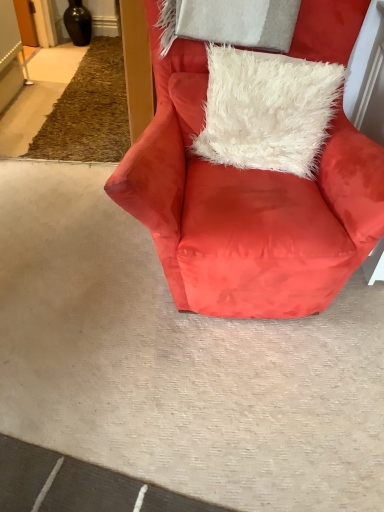
You are a GUI agent. You are given a task and a screenshot of the screen. Output one action in this format:
    pyautogui.click(x=<x>, y=<y>)
    Task: Click on the free space in front of satin red armchair at center
    The width and height of the screenshot is (384, 512).
    Given the screenshot: What is the action you would take?
    pyautogui.click(x=210, y=410)